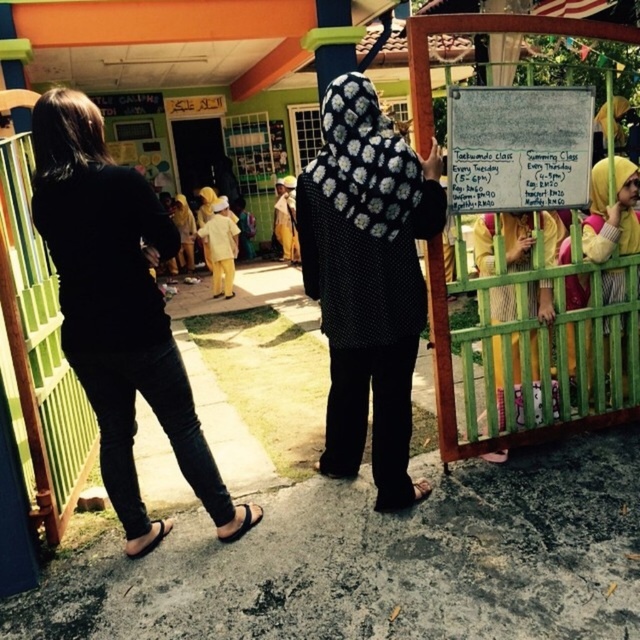
Question: Which is farther from the dry erase board at upper center?

Choices:
 (A) yellow fabric hijab at center
 (B) yellow fabric hijab at upper right

Answer: (A)

Question: Based on their relative distances, which object is farther from the yellow fabric hijab at center?

Choices:
 (A) yellow fabric hijab at upper right
 (B) black matte pants at lower left
 (C) yellow fabric headscarf at right

Answer: (C)

Question: Can you confirm if black dotted fabric at center is positioned to the right of dry erase board at upper center?

Choices:
 (A) no
 (B) yes

Answer: (A)

Question: In this image, where is dry erase board at upper center located relative to yellow fabric hijab at center?

Choices:
 (A) below
 (B) above

Answer: (A)

Question: Can you confirm if black matte pants at lower left is bigger than yellow fabric headscarf at right?

Choices:
 (A) no
 (B) yes

Answer: (B)

Question: Among these points, which one is farthest from the camera?

Choices:
 (A) pos(586,348)
 (B) pos(102,129)
 (C) pos(532,289)
 (D) pos(456,129)

Answer: (C)